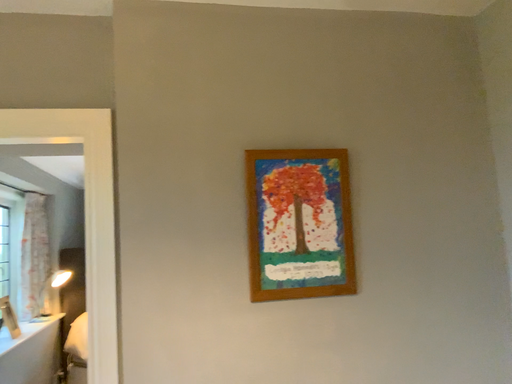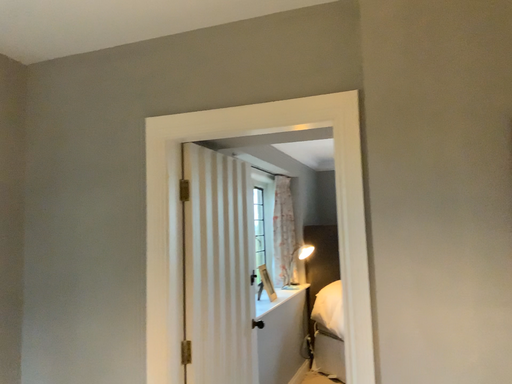
Question: Which way did the camera rotate in the video?

Choices:
 (A) rotated right
 (B) rotated left

Answer: (B)